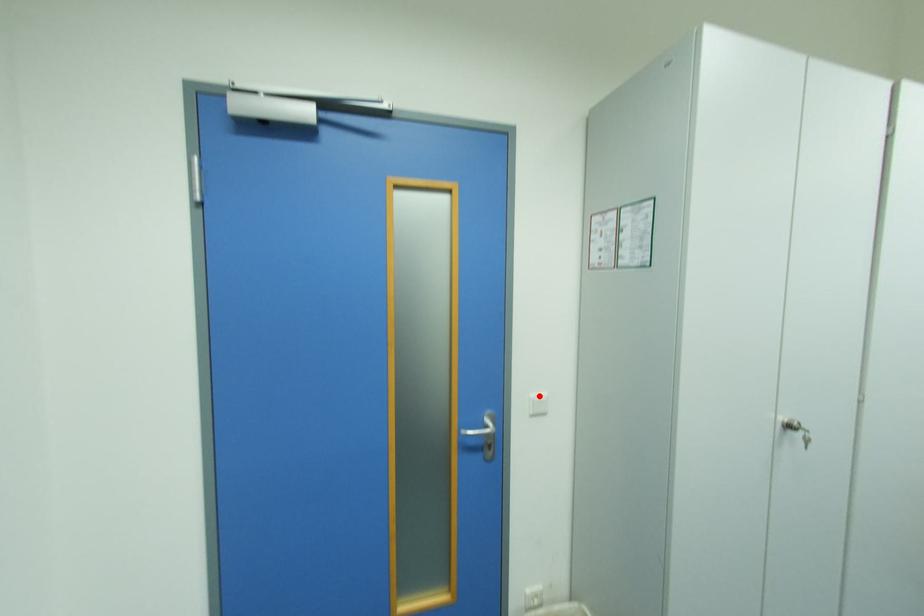
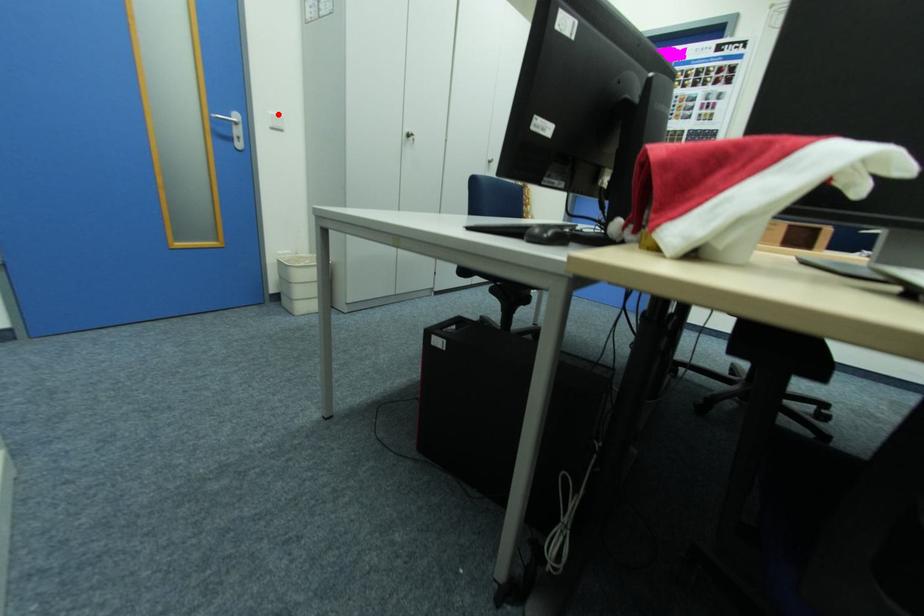
I am providing you with two images of the same scene from different viewpoints. A red point is marked on the first image and another point is marked on the second image. Is the red point in image1 aligned with the point shown in image2?

Yes